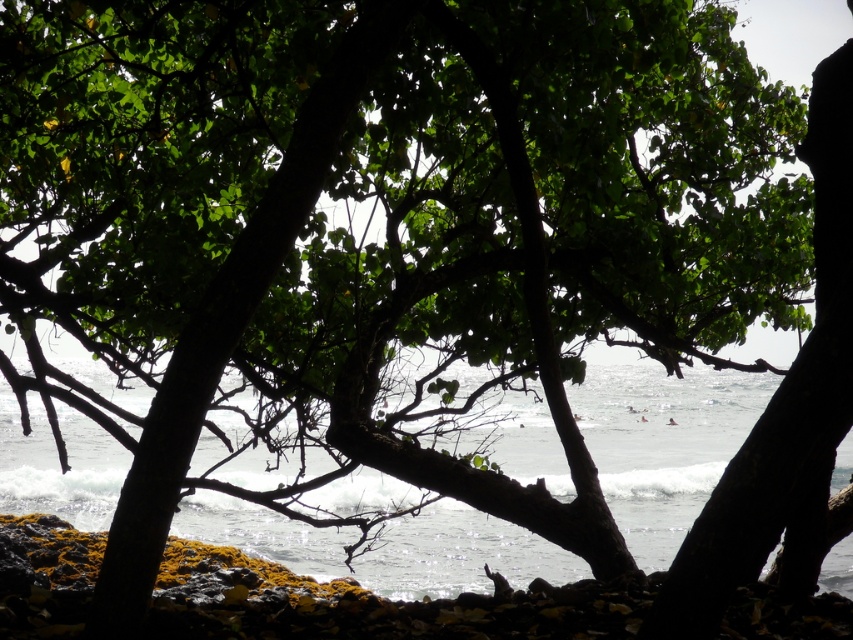
In the scene shown: Does clear water at center lie in front of green mossy rocks at lower center?

Yes, clear water at center is closer to the viewer.

Does clear water at center have a greater height compared to green mossy rocks at lower center?

Yes.

Where is `clear water at center`? This screenshot has width=853, height=640. clear water at center is located at coordinates (663, 444).